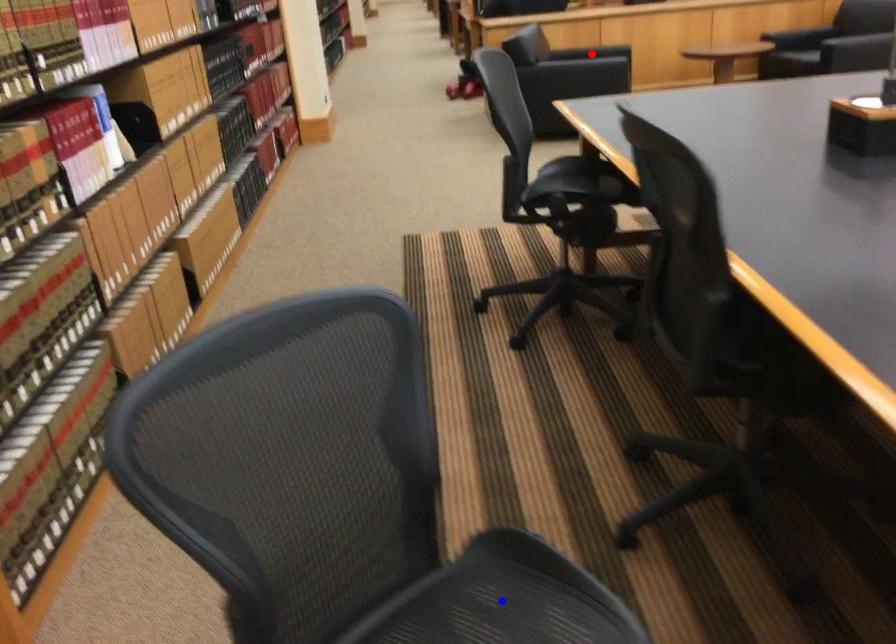
Question: Which of the two points in the image is closer to the camera?

Choices:
 (A) Blue point is closer.
 (B) Red point is closer.

Answer: (A)